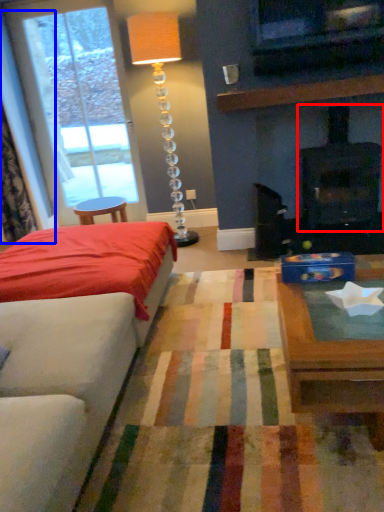
Question: Among these objects, which one is nearest to the camera, fireplace (highlighted by a red box) or curtain (highlighted by a blue box)?

Choices:
 (A) fireplace
 (B) curtain

Answer: (A)